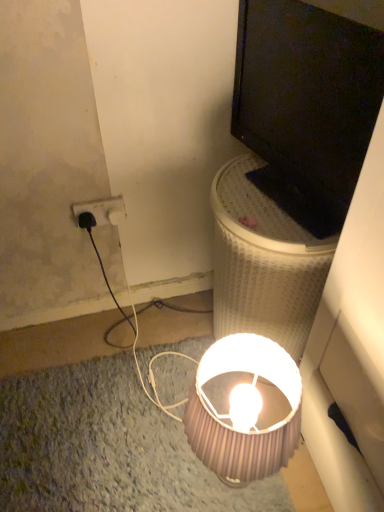
Describe the element at coordinates (259, 417) in the screenshot. I see `pink ribbed lampshade at lower center` at that location.

Measure the distance between point (88, 203) and camera.

Point (88, 203) is 4.03 feet from camera.

What is the approximate width of black glossy monitor at upper right?

black glossy monitor at upper right is 2.30 inches wide.

I want to click on black glossy monitor at upper right, so click(306, 105).

Where is `pink ribbed lampshade at lower center`? This screenshot has width=384, height=512. pink ribbed lampshade at lower center is located at coordinates (259, 417).

Is pink ribbed lampshade at lower center facing away from black glossy monitor at upper right?

pink ribbed lampshade at lower center is not turned away from black glossy monitor at upper right.

Considering the sizes of objects pink ribbed lampshade at lower center and black glossy monitor at upper right in the image provided, who is bigger, pink ribbed lampshade at lower center or black glossy monitor at upper right?

pink ribbed lampshade at lower center is bigger.

Does pink ribbed lampshade at lower center come behind black glossy monitor at upper right?

Yes.

From the image's perspective, is pink ribbed lampshade at lower center below black glossy monitor at upper right?

Yes, from the image's perspective, pink ribbed lampshade at lower center is beneath black glossy monitor at upper right.

From the image's perspective, which one is positioned lower, black plastic power outlet at upper left or black glossy monitor at upper right?

black plastic power outlet at upper left is shown below in the image.

Looking at their sizes, would you say black plastic power outlet at upper left is wider or thinner than black glossy monitor at upper right?

In the image, black plastic power outlet at upper left appears to be more narrow than black glossy monitor at upper right.

Is black plastic power outlet at upper left not close to black glossy monitor at upper right?

That's not correct — black plastic power outlet at upper left is a little close to black glossy monitor at upper right.

In the scene shown: Which is correct: black plastic power outlet at upper left is inside pink ribbed lampshade at lower center, or outside of it?

The correct answer is: outside.

From the image's perspective, is black plastic power outlet at upper left on pink ribbed lampshade at lower center?

Yes, from the image's perspective, black plastic power outlet at upper left is over pink ribbed lampshade at lower center.

How different are the orientations of black plastic power outlet at upper left and pink ribbed lampshade at lower center in degrees?

The angular difference between black plastic power outlet at upper left and pink ribbed lampshade at lower center is 91.4 degrees.

Is white mesh laundry basket at upper right positioned before pink ribbed lampshade at lower center?

That is False.

Would you consider white mesh laundry basket at upper right to be distant from pink ribbed lampshade at lower center?

No, white mesh laundry basket at upper right is not far away from pink ribbed lampshade at lower center.

Looking at this image, from a real-world perspective, which is physically above, white mesh laundry basket at upper right or pink ribbed lampshade at lower center?

In real-world perspective, white mesh laundry basket at upper right is above.

Locate an element on the screen. table on the right of pink ribbed lampshade at lower center is located at coordinates (263, 262).

Which of these two, black plastic power outlet at upper left or white mesh laundry basket at upper right, stands taller?

white mesh laundry basket at upper right is taller.

In the scene shown: Is there a large distance between black plastic power outlet at upper left and white mesh laundry basket at upper right?

No, black plastic power outlet at upper left is in close proximity to white mesh laundry basket at upper right.

Can you tell me how much black plastic power outlet at upper left and white mesh laundry basket at upper right differ in facing direction?

black plastic power outlet at upper left and white mesh laundry basket at upper right are facing 92.1 degrees away from each other.

From the picture: Measure the distance between black plastic power outlet at upper left and white mesh laundry basket at upper right.

black plastic power outlet at upper left and white mesh laundry basket at upper right are 18.29 inches apart.

Is black plastic power outlet at upper left inside pink ribbed lampshade at lower center?

No, black plastic power outlet at upper left is not surrounded by pink ribbed lampshade at lower center.

Locate an element on the screen. This screenshot has height=512, width=384. power outlet that appears above the pink ribbed lampshade at lower center (from the image's perspective) is located at coordinates (102, 210).

In the scene shown: In terms of height, does pink ribbed lampshade at lower center look taller or shorter compared to black plastic power outlet at upper left?

pink ribbed lampshade at lower center is taller than black plastic power outlet at upper left.

Consider the image. From a real-world perspective, is pink ribbed lampshade at lower center positioned above or below black plastic power outlet at upper left?

pink ribbed lampshade at lower center is below black plastic power outlet at upper left.

Can you confirm if white mesh laundry basket at upper right is thinner than black glossy monitor at upper right?

Incorrect, the width of white mesh laundry basket at upper right is not less than that of black glossy monitor at upper right.

From a real-world perspective, is white mesh laundry basket at upper right on top of black glossy monitor at upper right?

Actually, white mesh laundry basket at upper right is physically below black glossy monitor at upper right in the real world.

Is white mesh laundry basket at upper right at the right side of black glossy monitor at upper right?

No, white mesh laundry basket at upper right is not to the right of black glossy monitor at upper right.

From the image's perspective, who appears lower, white mesh laundry basket at upper right or black glossy monitor at upper right?

white mesh laundry basket at upper right is shown below in the image.

Find the location of `television in front of the pink ribbed lampshade at lower center`. television in front of the pink ribbed lampshade at lower center is located at coordinates (306, 105).

Identify the location of power outlet behind the black glossy monitor at upper right. (102, 210).

When comparing their distances from pink ribbed lampshade at lower center, does black plastic power outlet at upper left or white mesh laundry basket at upper right seem closer?

white mesh laundry basket at upper right is positioned closer to the anchor pink ribbed lampshade at lower center.

Which object lies nearer to the anchor point black plastic power outlet at upper left, white mesh laundry basket at upper right or black glossy monitor at upper right?

Among the two, white mesh laundry basket at upper right is located nearer to black plastic power outlet at upper left.

From the image, which object appears to be farther from black plastic power outlet at upper left, black glossy monitor at upper right or pink ribbed lampshade at lower center?

pink ribbed lampshade at lower center lies further to black plastic power outlet at upper left than the other object.

Which object lies nearer to the anchor point pink ribbed lampshade at lower center, white mesh laundry basket at upper right or black plastic power outlet at upper left?

The object closer to pink ribbed lampshade at lower center is white mesh laundry basket at upper right.

Estimate the real-world distances between objects in this image. Which object is closer to black glossy monitor at upper right, white mesh laundry basket at upper right or black plastic power outlet at upper left?

Based on the image, white mesh laundry basket at upper right appears to be nearer to black glossy monitor at upper right.

Which object lies nearer to the anchor point black plastic power outlet at upper left, pink ribbed lampshade at lower center or black glossy monitor at upper right?

The object closer to black plastic power outlet at upper left is black glossy monitor at upper right.

Estimate the real-world distances between objects in this image. Which object is further from black plastic power outlet at upper left, black glossy monitor at upper right or white mesh laundry basket at upper right?

black glossy monitor at upper right is positioned further to the anchor black plastic power outlet at upper left.

Based on their spatial positions, is black plastic power outlet at upper left or black glossy monitor at upper right further from white mesh laundry basket at upper right?

black plastic power outlet at upper left.

The width and height of the screenshot is (384, 512). I want to click on table between black glossy monitor at upper right and pink ribbed lampshade at lower center from top to bottom, so click(263, 262).

Find the location of a particular element. This screenshot has width=384, height=512. table located between black plastic power outlet at upper left and black glossy monitor at upper right in the left-right direction is located at coordinates (263, 262).

Identify the location of table that lies between black plastic power outlet at upper left and pink ribbed lampshade at lower center from top to bottom. (263, 262).

Where is `power outlet between black glossy monitor at upper right and pink ribbed lampshade at lower center in the vertical direction`? power outlet between black glossy monitor at upper right and pink ribbed lampshade at lower center in the vertical direction is located at coordinates (102, 210).